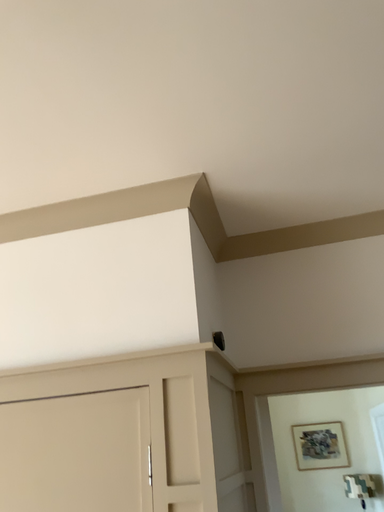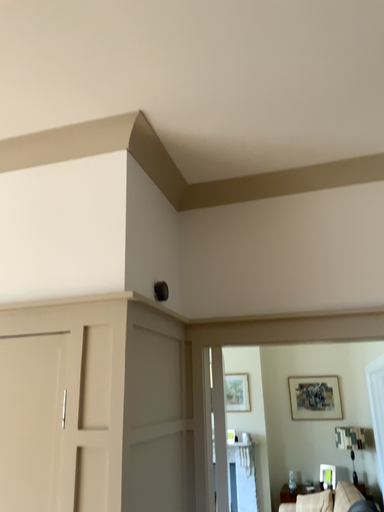
Question: Which way did the camera rotate in the video?

Choices:
 (A) rotated downward
 (B) rotated upward

Answer: (A)